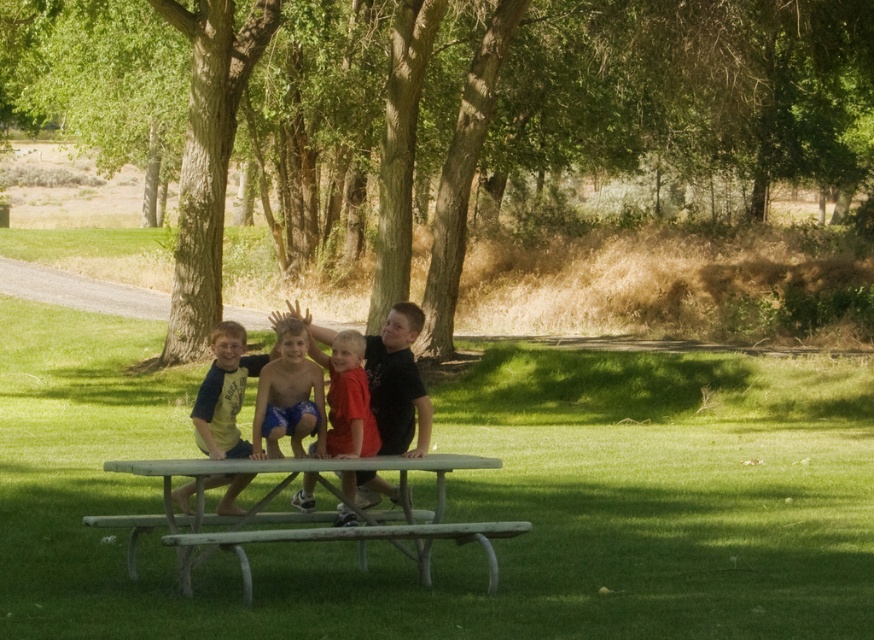
You are standing at the origin point of the image coordinate system. The picnic table is in front of you. Where is the blue shorts at center located in terms of coordinates?

The blue shorts at center is located at coordinates point (289, 396).

You are a photographer standing in the park and want to take a photo of the green painted wood picnic table at center and the yellow matte shirt at center. Which object should you adjust your camera to focus on first if you want to capture both in the same frame?

The green painted wood picnic table at center is to the right of yellow matte shirt at center, so you should focus on the yellow matte shirt at center first to ensure both are in frame.